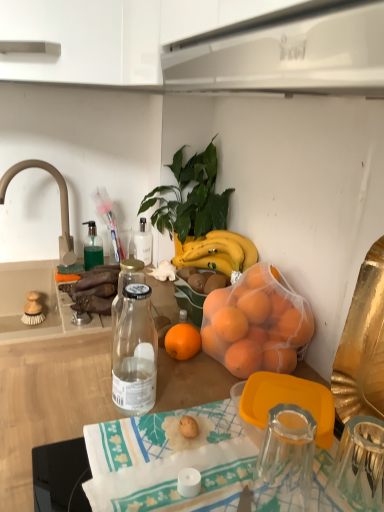
Find the location of a particular element. This screenshot has width=384, height=512. vacant space to the left of transparent glass coffee cup at center is located at coordinates (x=188, y=467).